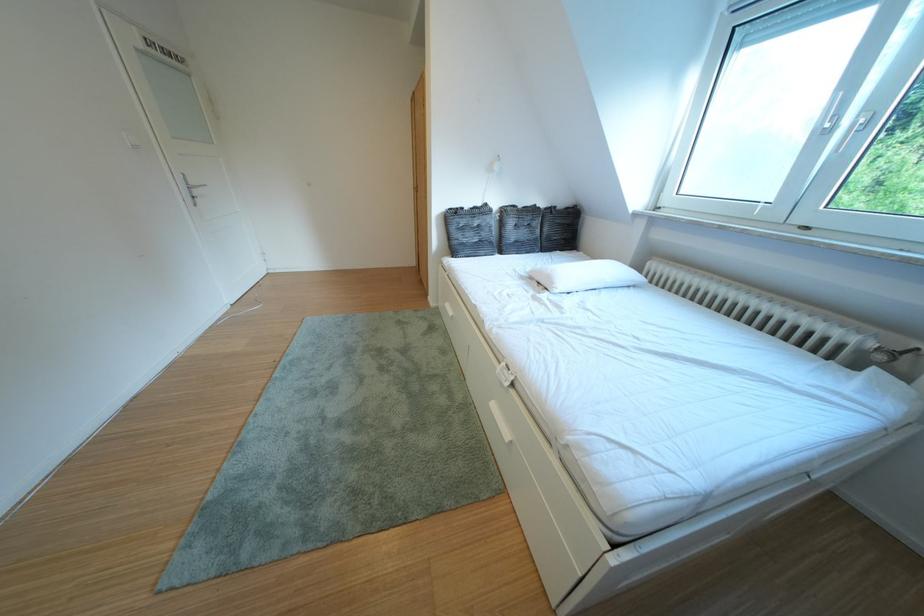
In order to click on silver door handle in this screenshot , I will do `click(190, 188)`.